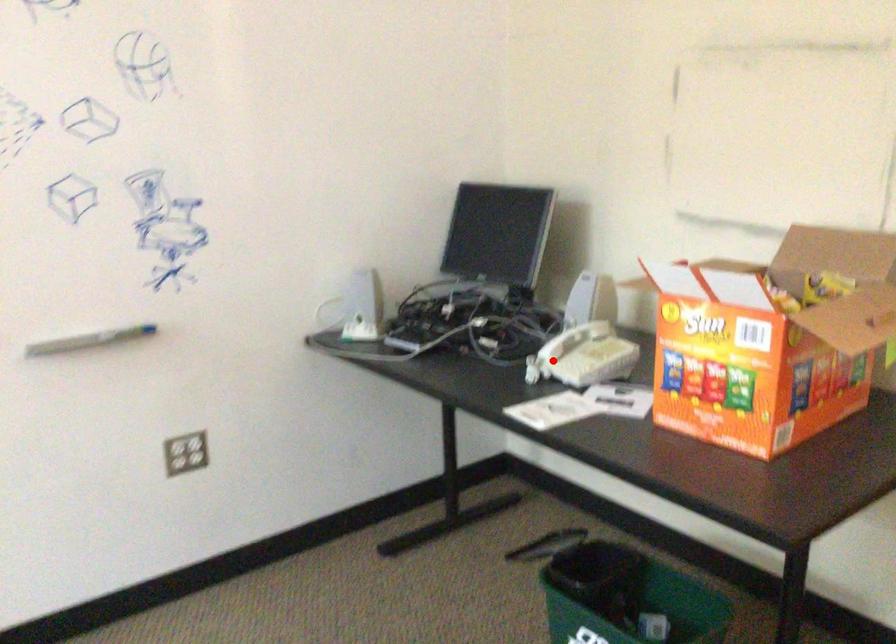
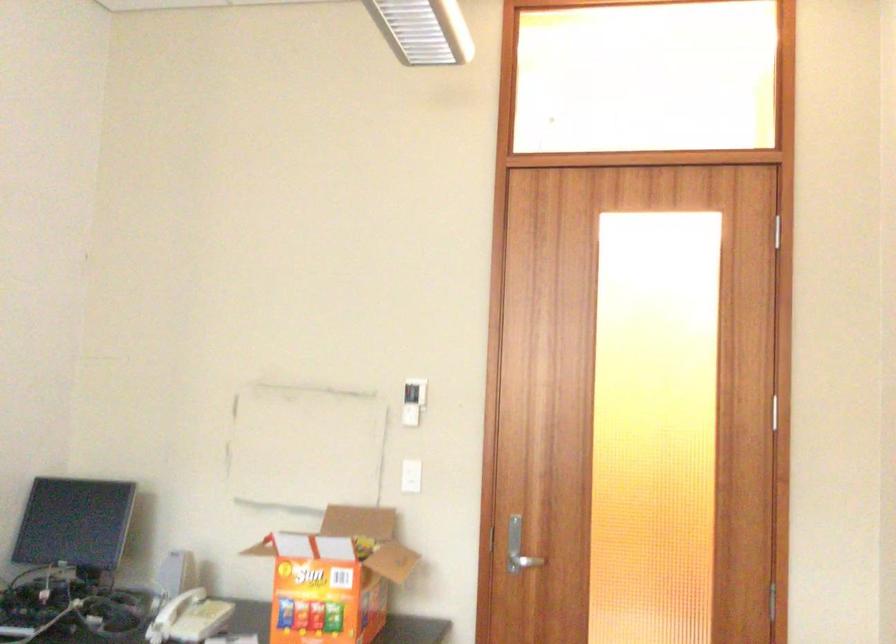
The point at the highlighted location is marked in the first image. Where is the corresponding point in the second image?

(170, 617)